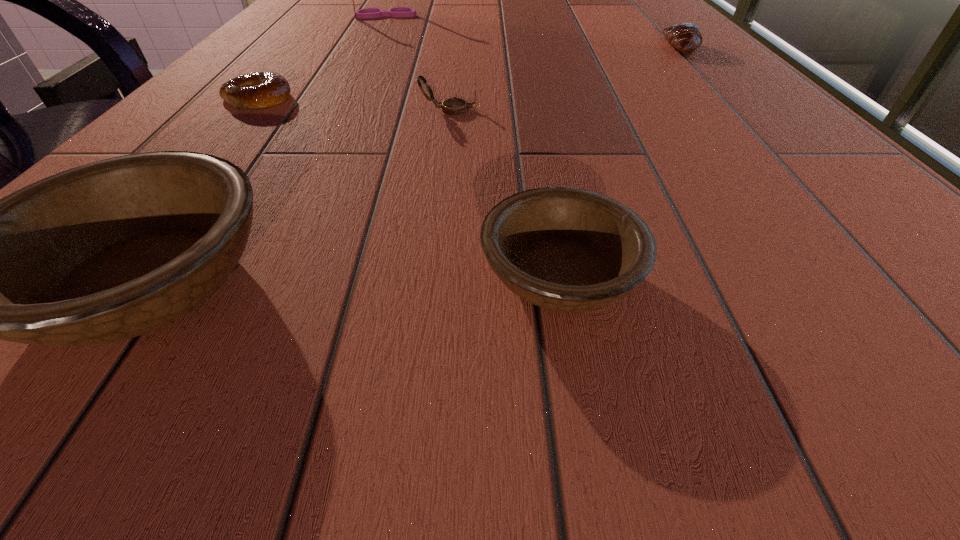
Locate an element on the screen. The height and width of the screenshot is (540, 960). unoccupied position between the shortest object and the shorter bowl is located at coordinates (409, 186).

This screenshot has width=960, height=540. Identify the location of vacant space in between the compass and the spectacles. (419, 63).

The width and height of the screenshot is (960, 540). Identify the location of free space between the bagel and the farthest object. coord(323,57).

You are a GUI agent. You are given a task and a screenshot of the screen. Output one action in this format:
    pyautogui.click(x=<x>, y=<y>)
    Task: Click on the blank region between the fourth object from left to right and the crescent roll
    
    Given the screenshot: What is the action you would take?
    pyautogui.click(x=565, y=78)

Where is `free space between the compass and the bagel`? This screenshot has height=540, width=960. free space between the compass and the bagel is located at coordinates (353, 104).

Find the location of a particular element. The image size is (960, 540). free spot between the tallest object and the bagel is located at coordinates (323, 57).

At what (x,y) coordinates should I click in order to perform the action: click on vacant area that lies between the spectacles and the compass. Please return your answer as a coordinate pair (x, y). This screenshot has height=540, width=960. Looking at the image, I should click on (419, 63).

Choose which object is the third nearest neighbor to the farthest object. Please provide its 2D coordinates. Your answer should be formatted as a tuple, i.e. [(x, y)], where the tuple contains the x and y coordinates of a point satisfying the conditions above.

[(686, 37)]

Identify which object is located as the third nearest to the compass. Please provide its 2D coordinates. Your answer should be formatted as a tuple, i.e. [(x, y)], where the tuple contains the x and y coordinates of a point satisfying the conditions above.

[(565, 249)]

You are a GUI agent. You are given a task and a screenshot of the screen. Output one action in this format:
    pyautogui.click(x=<x>, y=<y>)
    Task: Click on the vacant space that satisfies the following two spatial constraints: 1. on the face of the right bowl; 2. on the left side of the third object from right to left
    The image size is (960, 540).
    Given the screenshot: What is the action you would take?
    pyautogui.click(x=431, y=275)